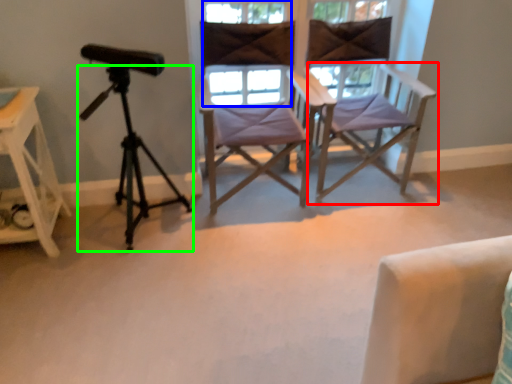
Question: Based on their relative distances, which object is nearer to chair (highlighted by a red box)? Choose from window (highlighted by a blue box) and tripod (highlighted by a green box).

Choices:
 (A) window
 (B) tripod

Answer: (A)